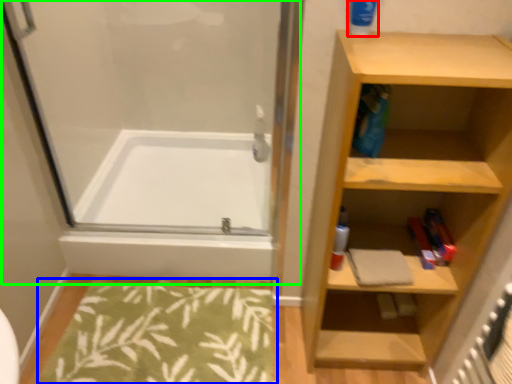
Question: Which object is the farthest from cleaning product (highlighted by a red box)? Choose among these: bath mat (highlighted by a blue box) or screen door (highlighted by a green box).

Choices:
 (A) bath mat
 (B) screen door

Answer: (A)